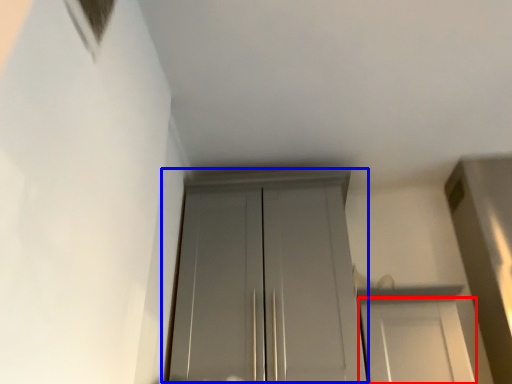
Question: Which object appears closest to the camera in this image, door (highlighted by a red box) or door (highlighted by a blue box)?

Choices:
 (A) door
 (B) door

Answer: (A)